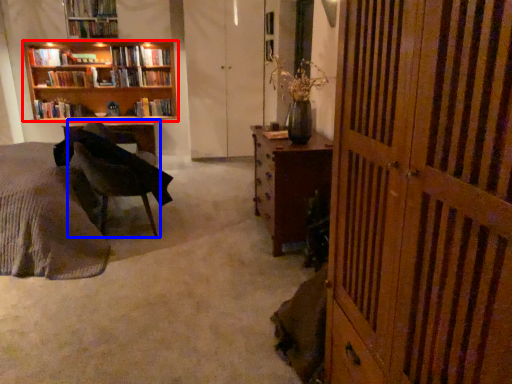
Question: Which object is further to the camera taking this photo, bookcase (highlighted by a red box) or chair (highlighted by a blue box)?

Choices:
 (A) bookcase
 (B) chair

Answer: (A)